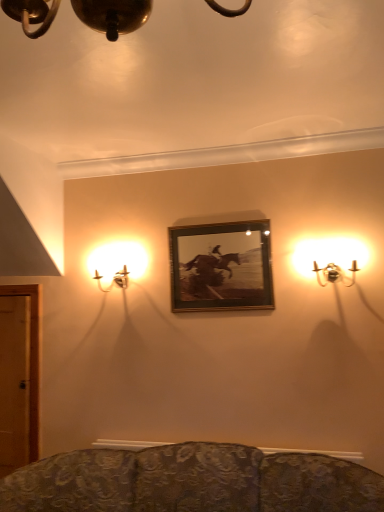
Question: Considering the relative positions of metallic gold sconce at left, the 1th lamp viewed from the back, and metallic wall sconce at right, which appears as the 2th lamp when viewed from the back, in the image provided, is metallic gold sconce at left, the 1th lamp viewed from the back, to the left or to the right of metallic wall sconce at right, which appears as the 2th lamp when viewed from the back,?

Choices:
 (A) left
 (B) right

Answer: (A)

Question: Considering the positions of metallic gold sconce at left, which is the first lamp in left-to-right order, and metallic wall sconce at right, positioned as the second lamp in left-to-right order, in the image, is metallic gold sconce at left, which is the first lamp in left-to-right order, bigger or smaller than metallic wall sconce at right, positioned as the second lamp in left-to-right order,?

Choices:
 (A) small
 (B) big

Answer: (B)

Question: Estimate the real-world distances between objects in this image. Which object is closer to the metallic wall sconce at right, positioned as the second lamp in left-to-right order?

Choices:
 (A) wooden frame at center
 (B) metallic gold sconce at left, the 1th lamp viewed from the back

Answer: (A)

Question: Which object is the closest to the wooden frame at center?

Choices:
 (A) metallic gold sconce at left, the 1th lamp viewed from the back
 (B) metallic wall sconce at right, acting as the first lamp starting from the right

Answer: (B)